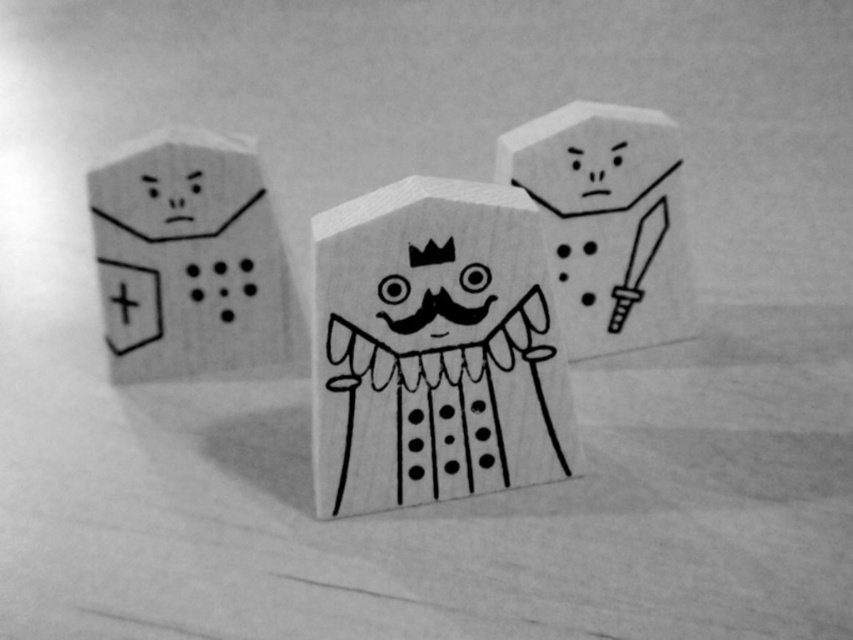
You have a toy car that is 5 inches long. You want to drive it from the wooden block at left to the wooden king at center. Is there enough space for the car to move between them?

The wooden king at center and wooden block at left are 10.33 inches apart from each other. Since the toy car is only 5 inches long, there is sufficient space for the car to move between them.

You are arranging these blocks for a display. If you want to place a small decorative item behind the wooden block at left, will it also be hidden from view by the wooden block at center?

The wooden block at left is in front of the wooden block at center, so placing a decorative item behind the wooden block at left would still be visible from the front since the wooden block at center is behind it and won

You are organizing these blocks on a shelf. The wooden block at left and the wooden block at center are currently stacked. Which block should you place first on the shelf to maintain their original arrangement?

You should place the wooden block at center first because the wooden block at left is positioned under it, so placing the lower block first allows the upper block to be placed on top.